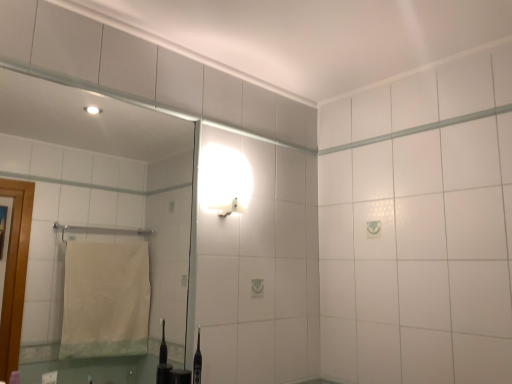
Question: Is white glossy wall sconce at upper center wider than clear glass mirror at upper left?

Choices:
 (A) yes
 (B) no

Answer: (A)

Question: Considering the relative sizes of white glossy wall sconce at upper center and clear glass mirror at upper left in the image provided, is white glossy wall sconce at upper center shorter than clear glass mirror at upper left?

Choices:
 (A) yes
 (B) no

Answer: (A)

Question: Considering the relative sizes of white glossy wall sconce at upper center and clear glass mirror at upper left in the image provided, is white glossy wall sconce at upper center smaller than clear glass mirror at upper left?

Choices:
 (A) no
 (B) yes

Answer: (B)

Question: From the image's perspective, would you say white glossy wall sconce at upper center is positioned over clear glass mirror at upper left?

Choices:
 (A) no
 (B) yes

Answer: (B)

Question: Does white glossy wall sconce at upper center have a larger size compared to clear glass mirror at upper left?

Choices:
 (A) no
 (B) yes

Answer: (A)

Question: Is white glossy wall sconce at upper center touching clear glass mirror at upper left?

Choices:
 (A) yes
 (B) no

Answer: (B)

Question: Is clear glass mirror at upper left thinner than white glossy wall sconce at upper center?

Choices:
 (A) no
 (B) yes

Answer: (B)

Question: Does clear glass mirror at upper left have a lesser height compared to white glossy wall sconce at upper center?

Choices:
 (A) yes
 (B) no

Answer: (B)

Question: From a real-world perspective, does clear glass mirror at upper left sit lower than white glossy wall sconce at upper center?

Choices:
 (A) no
 (B) yes

Answer: (B)

Question: Is clear glass mirror at upper left completely or partially outside of white glossy wall sconce at upper center?

Choices:
 (A) no
 (B) yes

Answer: (B)

Question: From a real-world perspective, is clear glass mirror at upper left physically above white glossy wall sconce at upper center?

Choices:
 (A) no
 (B) yes

Answer: (A)

Question: Considering the relative sizes of clear glass mirror at upper left and white glossy wall sconce at upper center in the image provided, is clear glass mirror at upper left wider than white glossy wall sconce at upper center?

Choices:
 (A) no
 (B) yes

Answer: (A)

Question: Is clear glass mirror at upper left situated inside white glossy wall sconce at upper center or outside?

Choices:
 (A) outside
 (B) inside

Answer: (A)